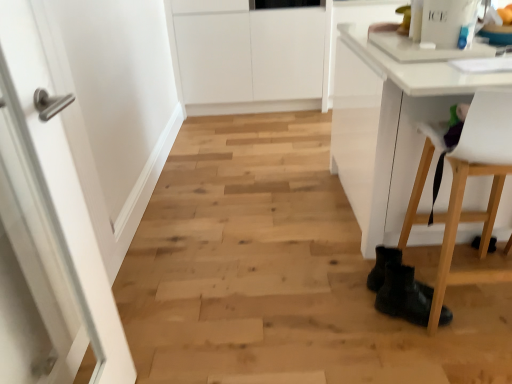
Image resolution: width=512 pixels, height=384 pixels. In order to click on white glossy door at left in this screenshot , I will do `click(52, 213)`.

This screenshot has height=384, width=512. What do you see at coordinates (466, 182) in the screenshot? I see `white plastic chair at lower right` at bounding box center [466, 182].

Locate an element on the screen. The height and width of the screenshot is (384, 512). white glossy door at left is located at coordinates (52, 213).

Does point (42, 235) appear closer or farther from the camera than point (483, 132)?

Point (42, 235).

Is white glossy door at left shorter than white plastic chair at lower right?

No.

Relative to white plastic chair at lower right, is white glossy door at left in front or behind?

white glossy door at left is in front of white plastic chair at lower right.

Find the location of `chair below the white glossy door at left (from a real-world perspective)`. chair below the white glossy door at left (from a real-world perspective) is located at coordinates (466, 182).

Can you confirm if black leather boots at lower right is thinner than white plastic chair at lower right?

Yes, black leather boots at lower right is thinner than white plastic chair at lower right.

Is the depth of black leather boots at lower right greater than that of white plastic chair at lower right?

Yes, it is.

In the scene shown: Which of these two, black leather boots at lower right or white plastic chair at lower right, stands shorter?

black leather boots at lower right.

From the image's perspective, is white plastic chair at lower right below white glossy door at left?

No.

The width and height of the screenshot is (512, 384). Find the location of `chair directly beneath the white glossy door at left (from a real-world perspective)`. chair directly beneath the white glossy door at left (from a real-world perspective) is located at coordinates (466, 182).

Considering the relative sizes of white plastic chair at lower right and white glossy door at left in the image provided, is white plastic chair at lower right thinner than white glossy door at left?

No.

Based on the photo, from the image's perspective, which is below, white plastic chair at lower right or black leather boots at lower right?

From the image's view, black leather boots at lower right is below.

How different are the orientations of white plastic chair at lower right and black leather boots at lower right in degrees?

110 degrees separate the facing orientations of white plastic chair at lower right and black leather boots at lower right.

Is white plastic chair at lower right oriented towards black leather boots at lower right?

No, white plastic chair at lower right does not turn towards black leather boots at lower right.

Which object is further away from the camera, white plastic chair at lower right or black leather boots at lower right?

black leather boots at lower right.

Does point (396, 275) lie in front of point (3, 128)?

No, (396, 275) is behind (3, 128).

Does black leather boots at lower right have a lesser width compared to white glossy door at left?

Incorrect, the width of black leather boots at lower right is not less than that of white glossy door at left.

From the image's perspective, is black leather boots at lower right above or below white glossy door at left?

black leather boots at lower right is situated lower than white glossy door at left in the image.

Between black leather boots at lower right and white glossy door at left, which one has smaller size?

black leather boots at lower right.

Choose the correct answer: Is white glossy door at left inside black leather boots at lower right or outside it?

white glossy door at left is spatially situated outside black leather boots at lower right.

Could you tell me if white glossy door at left is facing black leather boots at lower right?

No, white glossy door at left is not aimed at black leather boots at lower right.

From the image's perspective, would you say white glossy door at left is positioned over black leather boots at lower right?

Yes, from the image's perspective, white glossy door at left is over black leather boots at lower right.

From a real-world perspective, is white glossy door at left beneath black leather boots at lower right?

No.

Where is `chair that appears on the right of white glossy door at left`? The height and width of the screenshot is (384, 512). chair that appears on the right of white glossy door at left is located at coordinates (466, 182).

This screenshot has height=384, width=512. Identify the location of footwear located on the left of white plastic chair at lower right. coord(404,295).

Which object lies nearer to the anchor point black leather boots at lower right, white plastic chair at lower right or white glossy door at left?

white plastic chair at lower right is closer to black leather boots at lower right.

Which object lies further to the anchor point black leather boots at lower right, white glossy door at left or white plastic chair at lower right?

Based on the image, white glossy door at left appears to be further to black leather boots at lower right.

From the image, which object appears to be nearer to white glossy door at left, black leather boots at lower right or white plastic chair at lower right?

black leather boots at lower right lies closer to white glossy door at left than the other object.

Considering their positions, is white glossy door at left positioned closer to white plastic chair at lower right than black leather boots at lower right?

black leather boots at lower right is positioned closer to the anchor white plastic chair at lower right.

Based on their spatial positions, is white plastic chair at lower right or black leather boots at lower right closer to white glossy door at left?

black leather boots at lower right is positioned closer to the anchor white glossy door at left.

Looking at the image, which one is located further to white plastic chair at lower right, black leather boots at lower right or white glossy door at left?

Among the two, white glossy door at left is located further to white plastic chair at lower right.

At what (x,y) coordinates should I click in order to perform the action: click on footwear between white glossy door at left and white plastic chair at lower right from left to right. Please return your answer as a coordinate pair (x, y). The image size is (512, 384). Looking at the image, I should click on (404, 295).